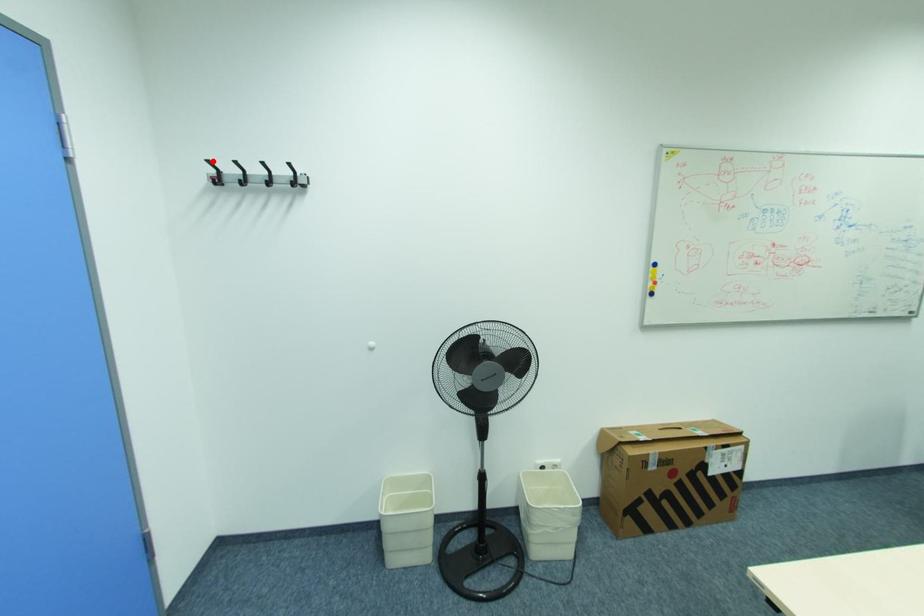
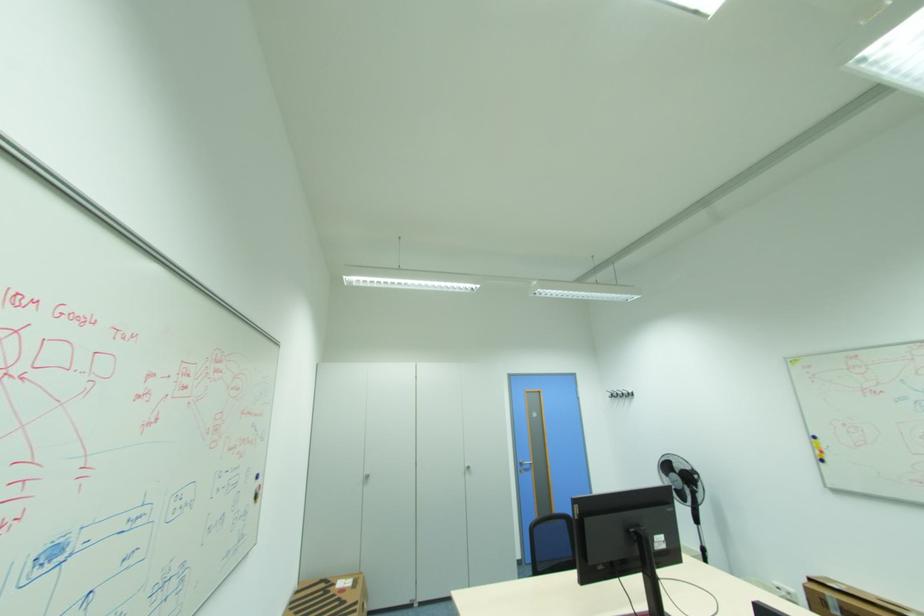
Question: A red point is marked in image1. In image2, is the corresponding 3D point closer to the camera or farther? Reply with the corresponding letter.

Choices:
 (A) The corresponding 3D point is closer.
 (B) The corresponding 3D point is farther.

Answer: (B)